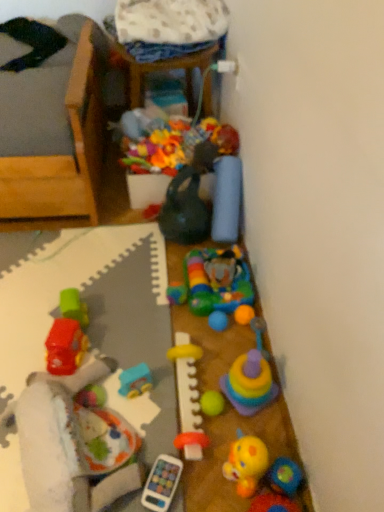
Find the location of a particular element. vacant region to the left of yellow rubber teething ring at center, the 4th toy from the left is located at coordinates (132, 393).